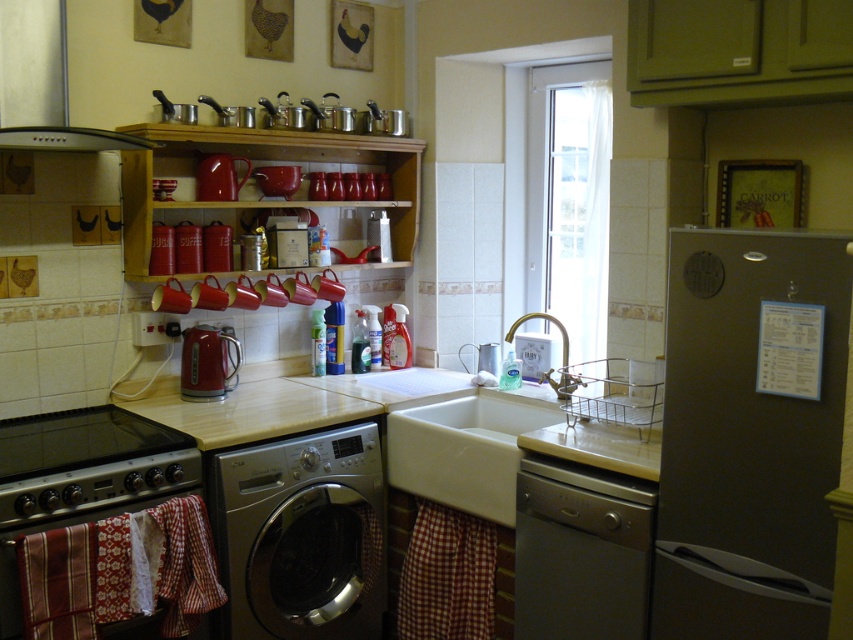
You are standing in the kitchen and need to place a large pot on the counter near the satin black refrigerator at right. Based on the scene description, where exactly should you place the pot?

The satin black refrigerator at right is located at point (747, 440), so you should place the large pot near that coordinate on the counter to ensure it is close to the refrigerator.

You are standing at the entrance of the kitchen and want to place a new appliance. Where exactly should you position it if you need to place it at the same coordinates as the silver metallic washing machine at lower center?

You should position the new appliance at point (300, 536), which is the same coordinates as the silver metallic washing machine at lower center.

You are organizing a dinner party and need to place a large platter that requires 1.2 meters of space. You have the satin silver dishwasher at lower center and the wooden shelves at upper center available. Which one can accommodate the platter?

The wooden shelves at upper center can accommodate the large platter since they have a greater width than the satin silver dishwasher at lower center, which is insufficient for the required 1.2 meters.